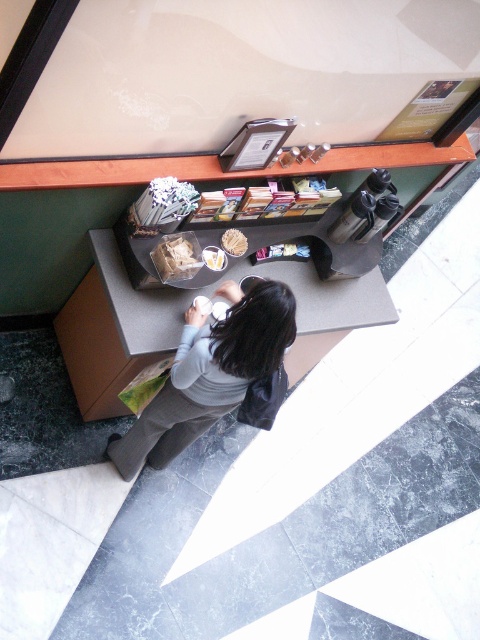
You are a barista working behind the counter in the image. You need to place a new sugar container exactly at the point marked as point (210, 372). Where should you place it relative to the dark gray sweater at center?

The dark gray sweater at center is located at point (210, 372), so you should place the new sugar container exactly where the dark gray sweater at center is positioned.

Based on the photo, you are a barista working behind the counter and need to place a new menu on the counter. The menu is made of white matte paper at center. However, there is a customer wearing a dark gray sweater at center in the way. From the customer standing at the counter, which object is closer to them?

The dark gray sweater at center is closer to the customer than the white matte paper at center because it is in front of it.

You are a barista preparing to place a white paper napkin at center and a white matte paper at center on the counter. The space between them must be exactly 3 inches. Based on the scene, will you need to adjust their positions?

The distance between the white paper napkin at center and the white matte paper at center is 2.97 inches, which is slightly less than the required 3 inches. Therefore, you should move them slightly apart to achieve the exact spacing.